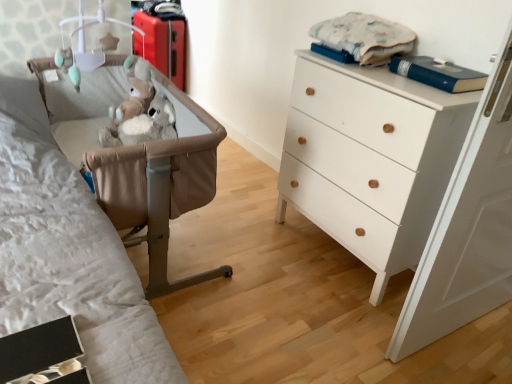
Question: From a real-world perspective, does tan leather crib at left stand above white plastic mobile at upper left?

Choices:
 (A) no
 (B) yes

Answer: (A)

Question: From a real-world perspective, is tan leather crib at left beneath white plastic mobile at upper left?

Choices:
 (A) no
 (B) yes

Answer: (B)

Question: Is tan leather crib at left at the left side of white plastic mobile at upper left?

Choices:
 (A) no
 (B) yes

Answer: (A)

Question: Is tan leather crib at left not within white plastic mobile at upper left?

Choices:
 (A) no
 (B) yes

Answer: (B)

Question: Is tan leather crib at left bigger than white plastic mobile at upper left?

Choices:
 (A) yes
 (B) no

Answer: (A)

Question: In terms of height, does white plastic mobile at upper left look taller or shorter compared to tan leather crib at left?

Choices:
 (A) short
 (B) tall

Answer: (A)

Question: Choose the correct answer: Is white plastic mobile at upper left inside tan leather crib at left or outside it?

Choices:
 (A) inside
 (B) outside

Answer: (B)

Question: Is point tap(77, 71) closer or farther from the camera than point tap(221, 137)?

Choices:
 (A) closer
 (B) farther

Answer: (B)

Question: Is white plastic mobile at upper left wider or thinner than tan leather crib at left?

Choices:
 (A) thin
 (B) wide

Answer: (A)

Question: From the image's perspective, relative to blue hardcover book at upper right, is white wood chest of drawers at right above or below?

Choices:
 (A) below
 (B) above

Answer: (A)

Question: Does point (333, 157) appear closer or farther from the camera than point (458, 82)?

Choices:
 (A) closer
 (B) farther

Answer: (B)

Question: Visually, is white wood chest of drawers at right positioned to the left or to the right of blue hardcover book at upper right?

Choices:
 (A) right
 (B) left

Answer: (B)

Question: Relative to blue hardcover book at upper right, is white wood chest of drawers at right in front or behind?

Choices:
 (A) front
 (B) behind

Answer: (A)

Question: From a real-world perspective, is white plastic mobile at upper left physically located above or below matte red suitcase at upper left?

Choices:
 (A) below
 (B) above

Answer: (B)

Question: Is white plastic mobile at upper left in front of or behind matte red suitcase at upper left in the image?

Choices:
 (A) front
 (B) behind

Answer: (A)